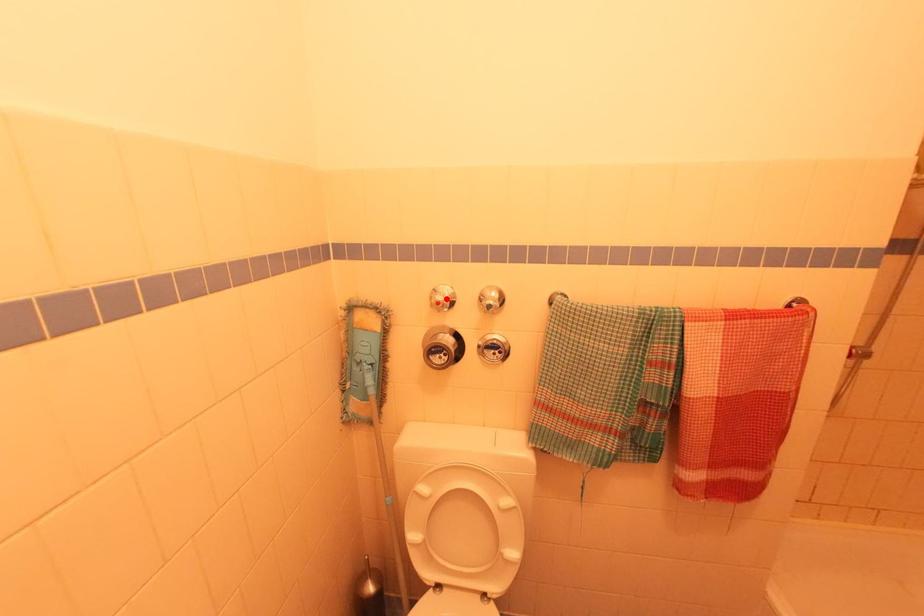
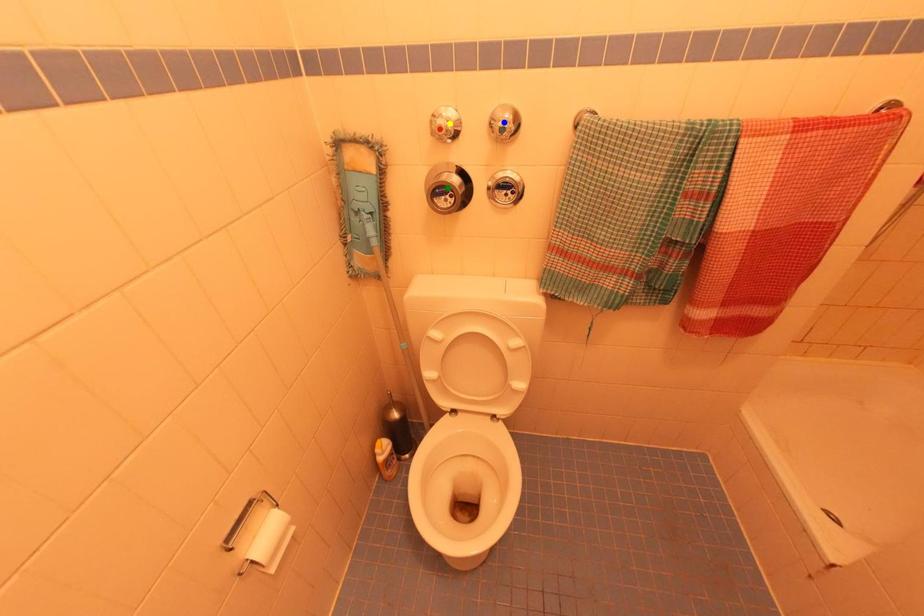
Question: I am providing you with two images of the same scene from different viewpoints. A red point is marked on the first image. You are given multiple points on the second image. Can you choose the point in image 2 that corresponds to the point in image 1?

Choices:
 (A) yellow point
 (B) blue point
 (C) green point

Answer: (A)